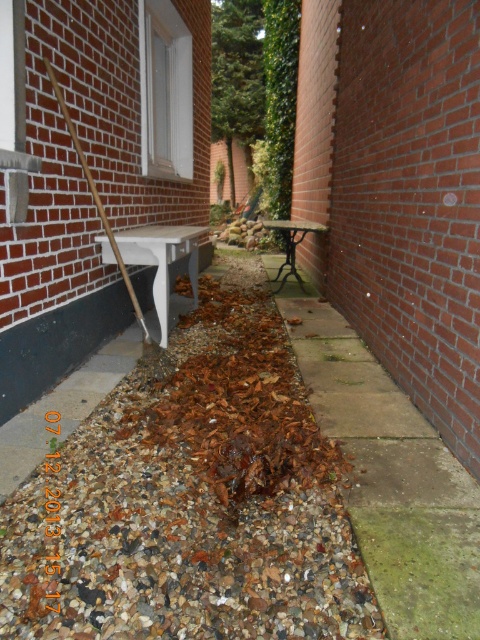
Looking at this image, you are a gardener who needs to place a new potted plant between the white glossy bench at left and the wooden bench at center. According to the scene, where should you position the potted plant to ensure it is between both benches?

The white glossy bench at left is located below the wooden bench at center. To place the potted plant between them, position it in the space between the lower white glossy bench at left and the higher wooden bench at center.

You are standing at the entrance of the narrow outdoor space between two brick walls. You need to locate the brown leaf litter at center. According to the coordinates provided, where exactly would you find it?

The brown leaf litter at center is located at point (192, 500).

From the picture: You are a gardener who needs to move the white glossy bench at left to access the brown leaf litter at center. Can you lift the bench over the leaf litter without stepping on it?

The brown leaf litter at center is shorter than the white glossy bench at left, so yes, the gardener can lift the bench over the leaf litter without stepping on it because the bench is taller than the leaf pile.